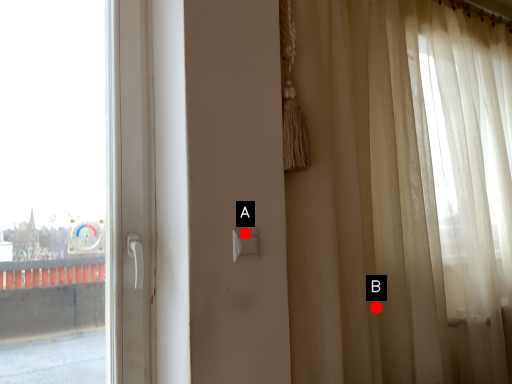
Question: Two points are circled on the image, labeled by A and B beside each circle. Which point is further to the camera?

Choices:
 (A) A is further
 (B) B is further

Answer: (B)